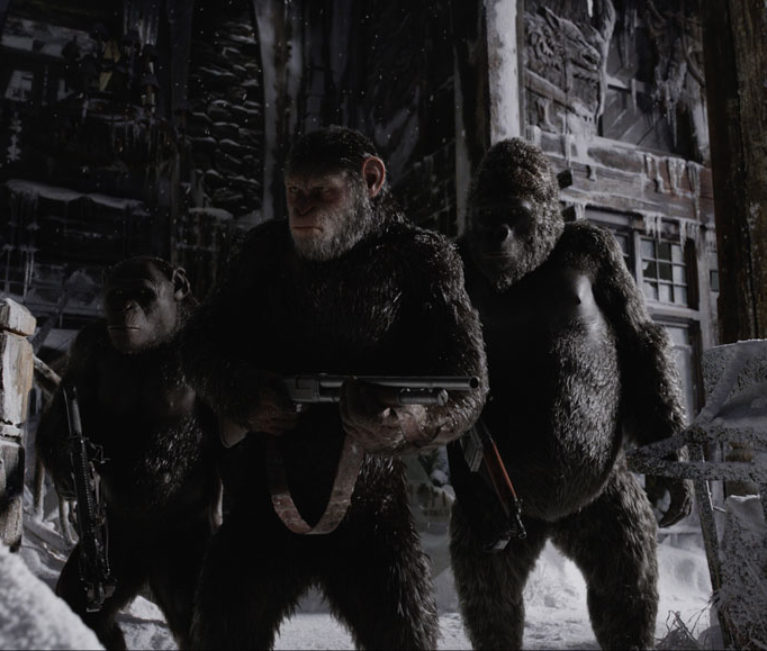
This screenshot has width=767, height=651. I want to click on window, so click(x=662, y=273).